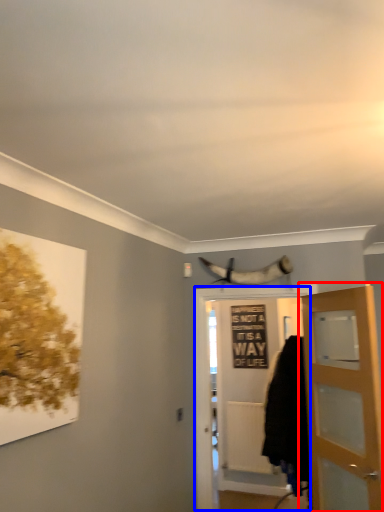
Question: Which object appears farthest to the camera in this image, door (highlighted by a red box) or door (highlighted by a blue box)?

Choices:
 (A) door
 (B) door

Answer: (B)